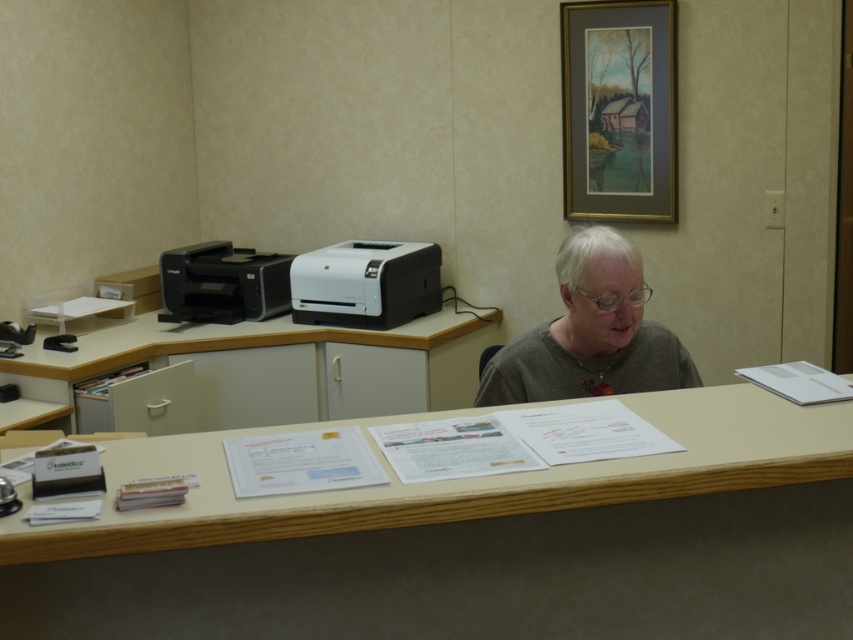
Question: Which object is farther from the camera taking this photo?

Choices:
 (A) wooden table at lower center
 (B) white plastic printer at center
 (C) gray matte shirt at center

Answer: (B)

Question: Can you confirm if wooden table at center is positioned below gray matte shirt at center?

Choices:
 (A) no
 (B) yes

Answer: (B)

Question: Which point is farther from the camera taking this photo?

Choices:
 (A) (572, 390)
 (B) (494, 513)

Answer: (A)

Question: Which is farther from the gray matte shirt at center?

Choices:
 (A) wooden table at center
 (B) matte black printer at left
 (C) white plastic printer at center

Answer: (B)

Question: Does wooden table at center have a lesser width compared to wooden table at lower center?

Choices:
 (A) yes
 (B) no

Answer: (A)

Question: Is gray matte shirt at center above white plastic printer at center?

Choices:
 (A) no
 (B) yes

Answer: (A)